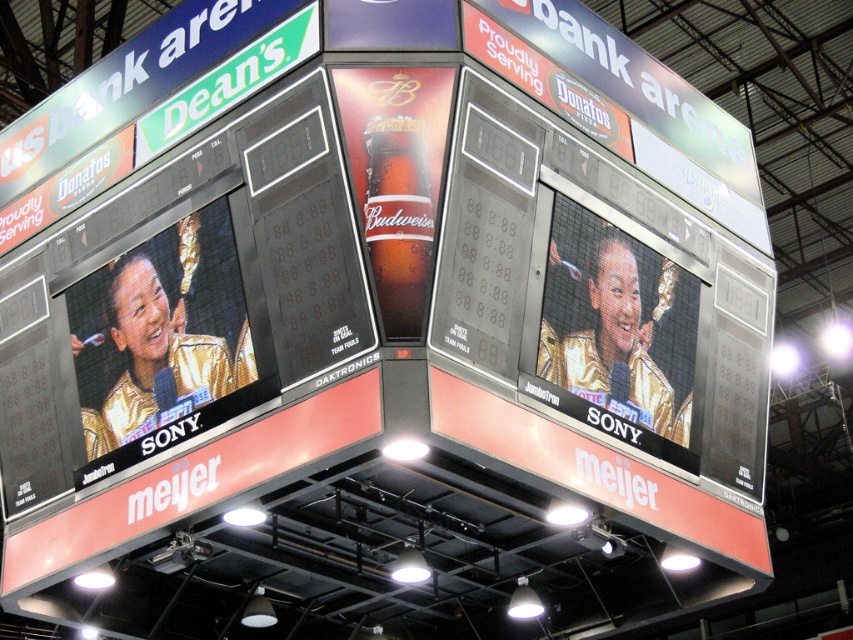
You are an event coordinator planning to place a new advertisement on the US Bank Arena scoreboard. The current scoreboard has a matte gold screen at right located at point (618, 326). You want to place a new ad for a local bakery. Where should you position the new ad to ensure it doesn

The matte gold screen at right is located at point (618, 326), so the new ad should be placed there to replace or complement the existing screen.

You are an event photographer standing in the center of the arena. You want to take a photo of the shiny glass budweiser at center and the matte gold screen at right. Which object should you focus on first to ensure both are in focus?

The matte gold screen at right is further to the viewer than the shiny glass budweiser at center. To ensure both are in focus, focus on the shiny glass budweiser at center first since it is closer, and the matte gold screen at right will naturally fall into the depth of field.